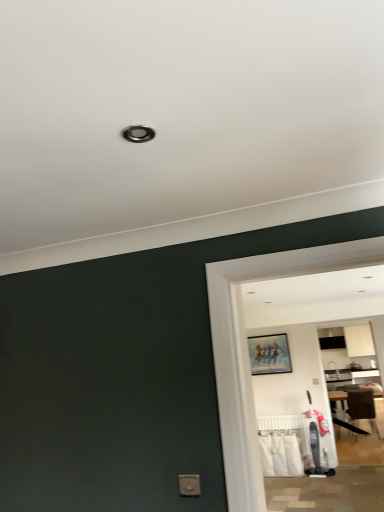
Measure the distance between matte wooden picture frame at center and camera.

matte wooden picture frame at center is 5.52 meters away from camera.

At what (x,y) coordinates should I click in order to perform the action: click on brown fabric chair at right. Please return your answer as a coordinate pair (x, y). Image resolution: width=384 pixels, height=512 pixels. Looking at the image, I should click on (363, 407).

Does white fabric laundry at lower right turn towards white plastic radiator at lower center?

No, white fabric laundry at lower right is not oriented towards white plastic radiator at lower center.

From a real-world perspective, is white fabric laundry at lower right above or below white plastic radiator at lower center?

white fabric laundry at lower right is below white plastic radiator at lower center.

Is white fabric laundry at lower right bigger than white plastic radiator at lower center?

Correct, white fabric laundry at lower right is larger in size than white plastic radiator at lower center.

Considering the sizes of objects white fabric laundry at lower right and white plastic radiator at lower center in the image provided, who is shorter, white fabric laundry at lower right or white plastic radiator at lower center?

Standing shorter between the two is white fabric laundry at lower right.

Would you consider white plastic radiator at lower center to be distant from white fabric laundry at lower right?

white plastic radiator at lower center is near white fabric laundry at lower right, not far away.

Considering the positions of objects white plastic radiator at lower center and white fabric laundry at lower right in the image provided, who is behind, white plastic radiator at lower center or white fabric laundry at lower right?

white plastic radiator at lower center is more distant.

Is white plastic radiator at lower center positioned beyond the bounds of white fabric laundry at lower right?

white plastic radiator at lower center is positioned outside white fabric laundry at lower right.

Considering the relative positions of white plastic radiator at lower center and matte wooden picture frame at center in the image provided, is white plastic radiator at lower center in front of matte wooden picture frame at center?

Yes, white plastic radiator at lower center is closer to the viewer.

Are white plastic radiator at lower center and matte wooden picture frame at center making contact?

No, white plastic radiator at lower center is not with matte wooden picture frame at center.

Visually, is white plastic radiator at lower center positioned to the left or to the right of matte wooden picture frame at center?

Based on their positions, white plastic radiator at lower center is located to the right of matte wooden picture frame at center.

Is brown fabric chair at right not near matte wooden picture frame at center?

Indeed, brown fabric chair at right is not near matte wooden picture frame at center.

Is brown fabric chair at right oriented towards matte wooden picture frame at center?

No, brown fabric chair at right does not turn towards matte wooden picture frame at center.

Looking at their sizes, would you say brown fabric chair at right is wider or thinner than matte wooden picture frame at center?

Clearly, brown fabric chair at right has more width compared to matte wooden picture frame at center.

Could you tell me if white plastic radiator at lower center is facing brown fabric chair at right?

No, white plastic radiator at lower center does not turn towards brown fabric chair at right.

How many degrees apart are the facing directions of white plastic radiator at lower center and brown fabric chair at right?

175 degrees separate the facing orientations of white plastic radiator at lower center and brown fabric chair at right.

From the image's perspective, which is below, white plastic radiator at lower center or brown fabric chair at right?

brown fabric chair at right, from the image's perspective.

Which of these two, white plastic radiator at lower center or brown fabric chair at right, stands shorter?

Standing shorter between the two is white plastic radiator at lower center.

From the image's perspective, which one is positioned lower, matte wooden picture frame at center or white fabric laundry at lower right?

From the image's view, white fabric laundry at lower right is below.

Is matte wooden picture frame at center to the right of white fabric laundry at lower right from the viewer's perspective?

Incorrect, matte wooden picture frame at center is not on the right side of white fabric laundry at lower right.

Considering the positions of objects matte wooden picture frame at center and white fabric laundry at lower right in the image provided, who is behind, matte wooden picture frame at center or white fabric laundry at lower right?

matte wooden picture frame at center.

In the scene shown: From a real-world perspective, which is physically below, matte wooden picture frame at center or brown fabric chair at right?

brown fabric chair at right is physically lower.

How distant is matte wooden picture frame at center from brown fabric chair at right?

They are 4.74 feet apart.

Considering the relative sizes of matte wooden picture frame at center and brown fabric chair at right in the image provided, is matte wooden picture frame at center wider than brown fabric chair at right?

In fact, matte wooden picture frame at center might be narrower than brown fabric chair at right.

Is brown fabric chair at right at the back of matte wooden picture frame at center?

No, brown fabric chair at right is not at the back of matte wooden picture frame at center.

I want to click on radiator on the right side of white fabric laundry at lower right, so click(288, 430).

Where is `laundry below the white plastic radiator at lower center (from a real-world perspective)`? laundry below the white plastic radiator at lower center (from a real-world perspective) is located at coordinates (280, 455).

Based on their spatial positions, is white fabric laundry at lower right or white plastic radiator at lower center further from matte wooden picture frame at center?

white fabric laundry at lower right is further to matte wooden picture frame at center.

Considering their positions, is matte wooden picture frame at center positioned closer to white fabric laundry at lower right than white plastic radiator at lower center?

white plastic radiator at lower center.

Considering their positions, is white fabric laundry at lower right positioned further to brown fabric chair at right than matte wooden picture frame at center?

Based on the image, matte wooden picture frame at center appears to be further to brown fabric chair at right.

From the image, which object appears to be farther from white fabric laundry at lower right, brown fabric chair at right or white plastic radiator at lower center?

Among the two, brown fabric chair at right is located further to white fabric laundry at lower right.

From the image, which object appears to be farther from white fabric laundry at lower right, matte wooden picture frame at center or brown fabric chair at right?

brown fabric chair at right lies further to white fabric laundry at lower right than the other object.

Estimate the real-world distances between objects in this image. Which object is further from brown fabric chair at right, matte wooden picture frame at center or white fabric laundry at lower right?

Based on the image, matte wooden picture frame at center appears to be further to brown fabric chair at right.

From the image, which object appears to be farther from white fabric laundry at lower right, white plastic radiator at lower center or brown fabric chair at right?

brown fabric chair at right.

Looking at the image, which one is located further to white fabric laundry at lower right, brown fabric chair at right or matte wooden picture frame at center?

Among the two, brown fabric chair at right is located further to white fabric laundry at lower right.

Where is `laundry between matte wooden picture frame at center and brown fabric chair at right from left to right`? This screenshot has width=384, height=512. laundry between matte wooden picture frame at center and brown fabric chair at right from left to right is located at coordinates (280, 455).

Identify the location of radiator between matte wooden picture frame at center and white fabric laundry at lower right from top to bottom. The image size is (384, 512). (288, 430).

Locate an element on the screen. radiator between matte wooden picture frame at center and brown fabric chair at right in the horizontal direction is located at coordinates (288, 430).

The width and height of the screenshot is (384, 512). Identify the location of radiator situated between white fabric laundry at lower right and brown fabric chair at right from left to right. (288, 430).